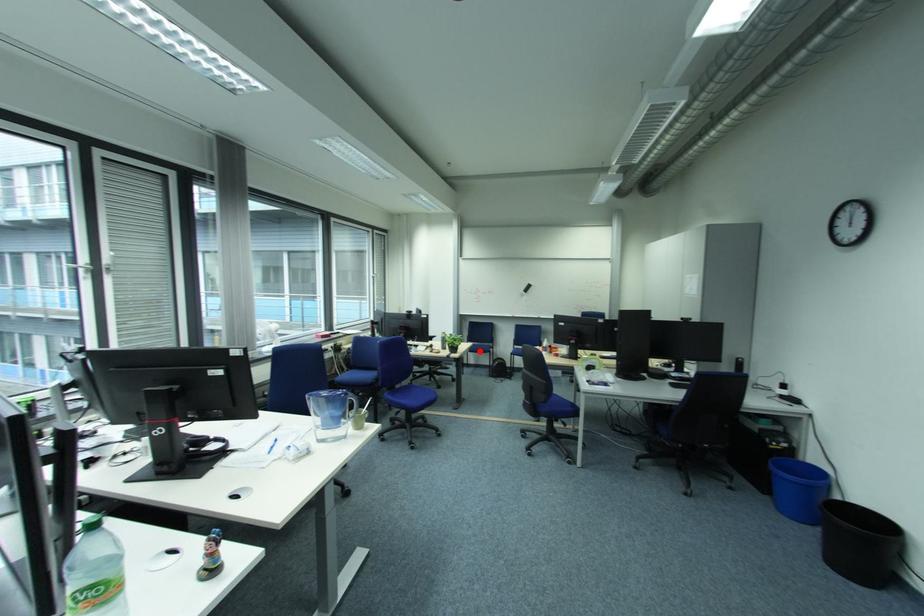
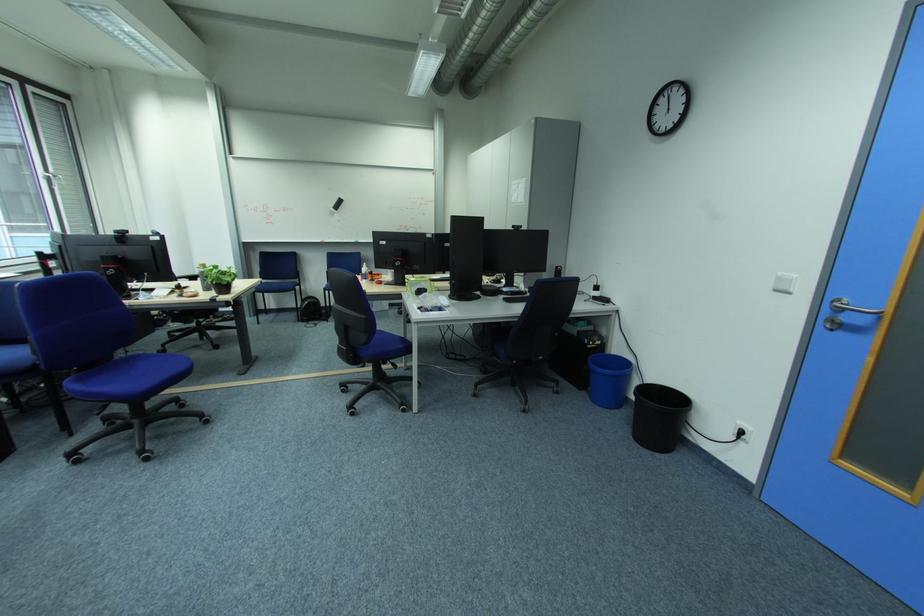
Question: I am providing you with two images of the same scene from different viewpoints. In image1, a red point is highlighted. Considering the same 3D point in image2, which of the following is correct?

Choices:
 (A) It is closer
 (B) It is farther

Answer: (A)